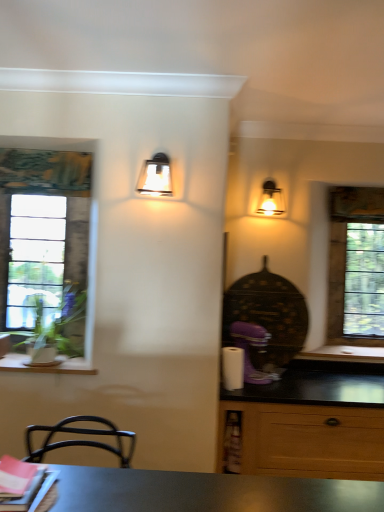
Question: Can you confirm if matte glass sconce at upper right, which appears as the 2th lamp when viewed from the left, is shorter than clear glass window at left, the 2th window when ordered from right to left?

Choices:
 (A) yes
 (B) no

Answer: (A)

Question: Can you confirm if matte glass sconce at upper right, which appears as the 2th lamp when viewed from the left, is taller than clear glass window at left, the 1th window when ordered from front to back?

Choices:
 (A) yes
 (B) no

Answer: (B)

Question: Is matte glass sconce at upper right, the second lamp in the front-to-back sequence, not inside clear glass window at left, the 1th window when ordered from front to back?

Choices:
 (A) yes
 (B) no

Answer: (A)

Question: Considering the relative positions of matte glass sconce at upper right, the second lamp in the front-to-back sequence, and clear glass window at left, the 2th window positioned from the back, in the image provided, is matte glass sconce at upper right, the second lamp in the front-to-back sequence, in front of clear glass window at left, the 2th window positioned from the back,?

Choices:
 (A) no
 (B) yes

Answer: (A)

Question: Can you confirm if matte glass sconce at upper right, the first lamp viewed from the back, is bigger than clear glass window at left, the 1th window when ordered from front to back?

Choices:
 (A) yes
 (B) no

Answer: (B)

Question: Is point (263, 182) closer or farther from the camera than point (21, 367)?

Choices:
 (A) closer
 (B) farther

Answer: (B)

Question: Which is correct: matte glass sconce at upper right, the second lamp in the front-to-back sequence, is inside wooden at left, or outside of it?

Choices:
 (A) inside
 (B) outside

Answer: (B)

Question: Is matte glass sconce at upper right, the first lamp viewed from the right, bigger or smaller than wooden at left?

Choices:
 (A) small
 (B) big

Answer: (B)

Question: From a real-world perspective, is matte glass sconce at upper right, the first lamp viewed from the back, positioned above or below wooden at left?

Choices:
 (A) above
 (B) below

Answer: (A)

Question: From the image's perspective, is clear glass window at right, which ranks as the 1th window in right-to-left order, above or below metallic glass sconce at upper center, acting as the second lamp starting from the right?

Choices:
 (A) below
 (B) above

Answer: (A)

Question: Is point (375, 199) closer or farther from the camera than point (148, 160)?

Choices:
 (A) farther
 (B) closer

Answer: (A)

Question: From a real-world perspective, is clear glass window at right, which is counted as the 2th window, starting from the left, physically located above or below metallic glass sconce at upper center, which appears as the first lamp when viewed from the front?

Choices:
 (A) above
 (B) below

Answer: (B)

Question: In the image, is clear glass window at right, which ranks as the 1th window in back-to-front order, on the left side or the right side of metallic glass sconce at upper center, which is the second lamp in back-to-front order?

Choices:
 (A) left
 (B) right

Answer: (B)

Question: In terms of width, does matte glass sconce at upper right, which appears as the 2th lamp when viewed from the left, look wider or thinner when compared to metallic glass sconce at upper center, marked as the first lamp in a left-to-right arrangement?

Choices:
 (A) wide
 (B) thin

Answer: (B)

Question: Would you say matte glass sconce at upper right, the first lamp viewed from the right, is to the left or to the right of metallic glass sconce at upper center, which appears as the first lamp when viewed from the front, in the picture?

Choices:
 (A) left
 (B) right

Answer: (B)